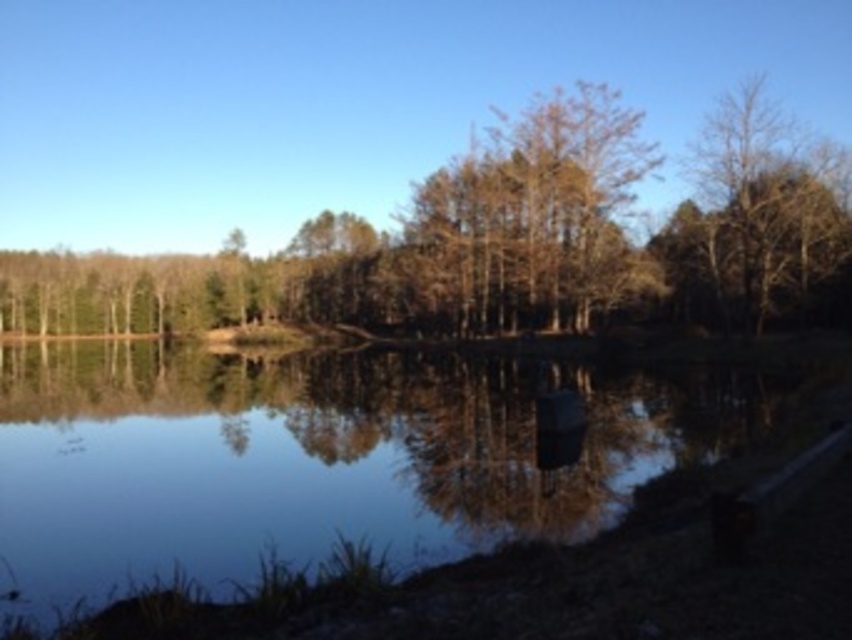
Question: Is smooth reflective water at center to the left of brown leafy tree at center from the viewer's perspective?

Choices:
 (A) yes
 (B) no

Answer: (B)

Question: Among these points, which one is nearest to the camera?

Choices:
 (A) (712, 289)
 (B) (271, 400)

Answer: (B)

Question: Which of the following is the closest to the observer?

Choices:
 (A) (225, 276)
 (B) (809, 348)

Answer: (B)

Question: Which point appears farthest from the camera in this image?

Choices:
 (A) (372, 308)
 (B) (317, 461)

Answer: (A)

Question: Is the position of smooth reflective water at center more distant than that of brown leafy tree at center?

Choices:
 (A) yes
 (B) no

Answer: (B)

Question: From the image, what is the correct spatial relationship of smooth reflective water at center in relation to brown leafy tree at center?

Choices:
 (A) below
 (B) above

Answer: (A)